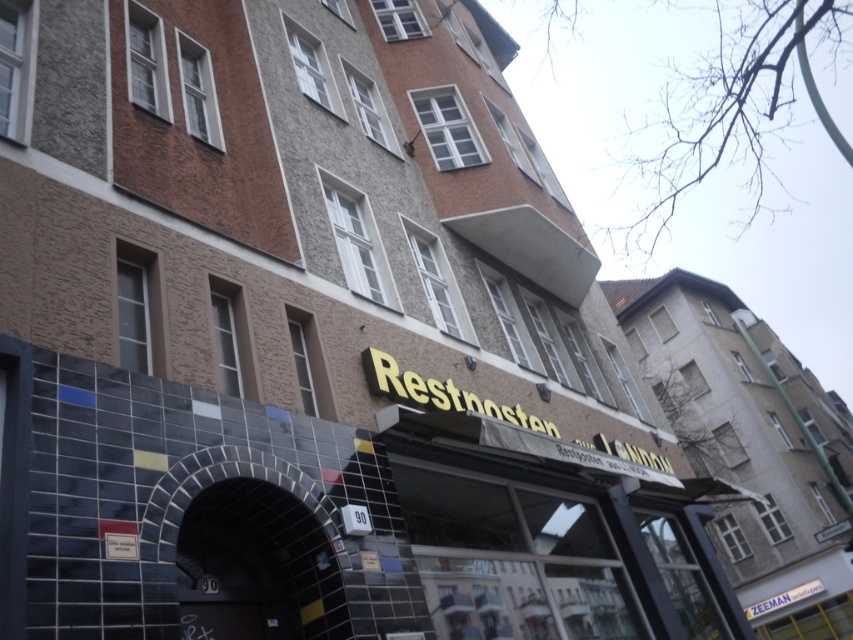
Is matte yellow sign at center smaller than black tile archway at center?

Actually, matte yellow sign at center might be larger than black tile archway at center.

Is matte yellow sign at center closer to the viewer compared to black tile archway at center?

That is False.

The width and height of the screenshot is (853, 640). Find the location of `matte yellow sign at center`. matte yellow sign at center is located at coordinates (751, 445).